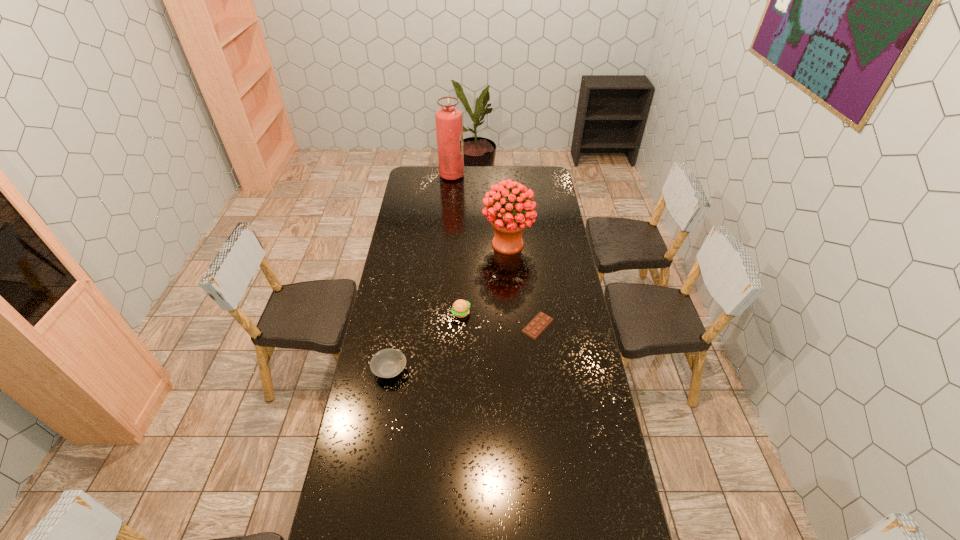
Find the location of a particular element. free space between the chocolate bar and the bowl is located at coordinates (464, 348).

You are a GUI agent. You are given a task and a screenshot of the screen. Output one action in this format:
    pyautogui.click(x=<x>, y=<y>)
    Task: Click on the vacant point located between the nearest object and the hamburger
    This screenshot has height=540, width=960.
    Given the screenshot: What is the action you would take?
    pyautogui.click(x=425, y=341)

Where is `empty space that is in between the leftmost object and the farthest object`? The image size is (960, 540). empty space that is in between the leftmost object and the farthest object is located at coordinates (420, 273).

Locate an element on the screen. empty location between the shortest object and the fire extinguisher is located at coordinates (494, 251).

The image size is (960, 540). Identify the location of free space between the nearest object and the shortest object. (464, 348).

Identify the location of vacant area that lies between the hamburger and the leftmost object. (425, 341).

At what (x,y) coordinates should I click in order to perform the action: click on empty location between the shortest object and the bouquet. Please return your answer as a coordinate pair (x, y). Image resolution: width=960 pixels, height=540 pixels. Looking at the image, I should click on (522, 285).

I want to click on empty location between the bouquet and the farthest object, so click(x=480, y=210).

Locate an element on the screen. blank region between the bouquet and the leftmost object is located at coordinates (448, 307).

The image size is (960, 540). I want to click on free space between the fourth shortest object and the second shortest object, so click(x=448, y=307).